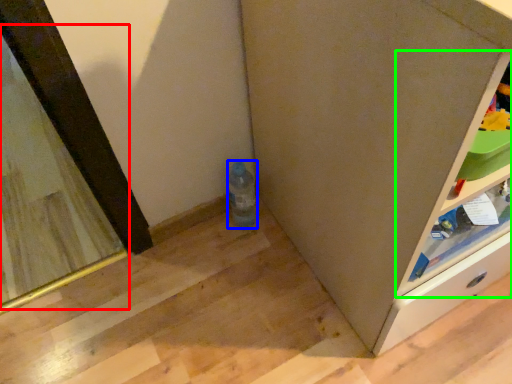
Question: Which object is positioned farthest from mirror (highlighted by a red box)? Select from bottle (highlighted by a blue box) and shelf (highlighted by a green box).

Choices:
 (A) bottle
 (B) shelf

Answer: (B)